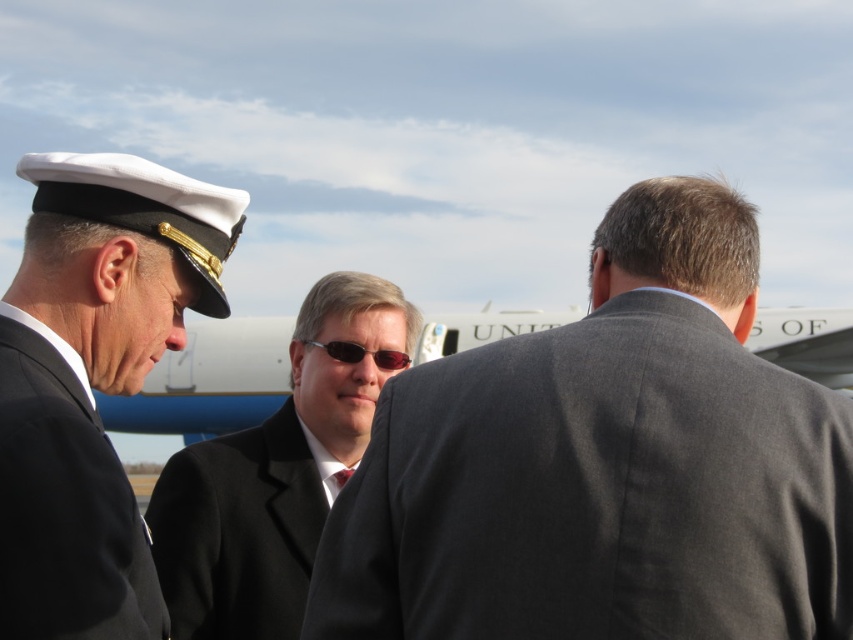
You are a photographer trying to capture a candid shot of the man in the black suit at center and the sunglasses at center. Since you want to focus on their facial expressions, which object should you adjust your camera angle to prioritize?

You should prioritize focusing on the sunglasses at center because the black suit at center is below it, making the sunglasses more visible for capturing facial expressions.

You are standing at the point marked as point (314, 451) in the image. You want to walk straight towards the nearest object in the scene. Which object will you first encounter?

The first object you will encounter when walking straight from point (314, 451) is the airplane in the background since it is the closest object in that direction.